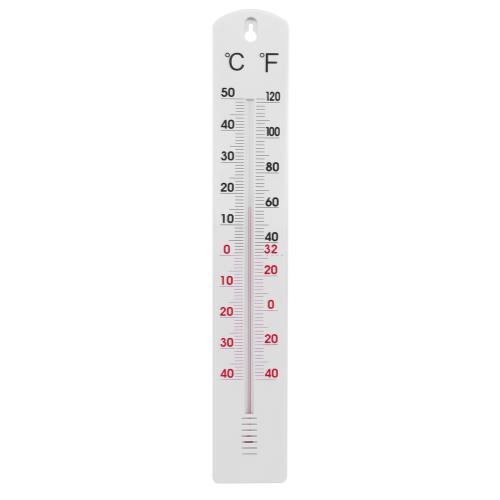
Where is `plastic thermometer`? The image size is (500, 500). plastic thermometer is located at coordinates (265, 411).